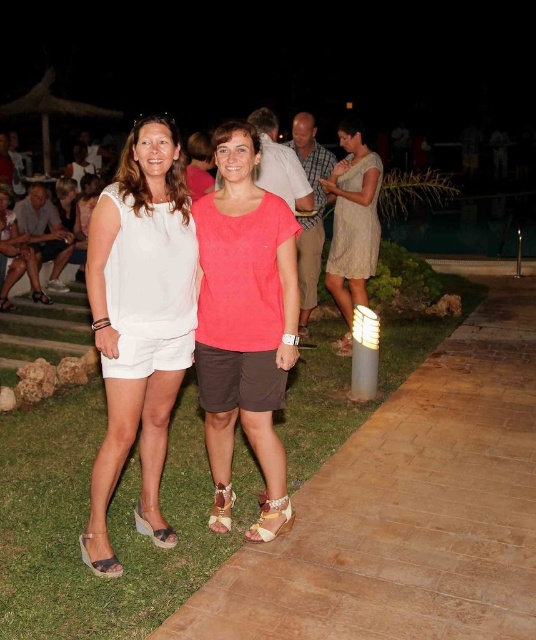
Is the position of white cotton shorts at center less distant than that of matte black wedge sandal at lower left?

That is True.

Is point (110, 429) less distant than point (139, 508)?

Yes, point (110, 429) is closer to viewer.

At what (x,y) coordinates should I click in order to perform the action: click on white cotton shorts at center. Please return your answer as a coordinate pair (x, y). This screenshot has width=536, height=640. Looking at the image, I should click on (139, 310).

Who is shorter, coral matte t-shirt at center or white fabric sandal at lower left?

Standing shorter between the two is white fabric sandal at lower left.

Who is more distant from viewer, (255, 148) or (40, 291)?

The point (40, 291) is more distant.

Between point (278, 244) and point (50, 304), which one is positioned behind?

Positioned behind is point (50, 304).

You are a GUI agent. You are given a task and a screenshot of the screen. Output one action in this format:
    pyautogui.click(x=<x>, y=<y>)
    Task: Click on the coral matte t-shirt at center
    
    Given the screenshot: What is the action you would take?
    pyautogui.click(x=245, y=317)

In the scene shown: Is leather sandal at center shorter than white fabric sandal at lower left?

Incorrect, leather sandal at center's height does not fall short of white fabric sandal at lower left's.

Who is higher up, leather sandal at center or white fabric sandal at lower left?

white fabric sandal at lower left is higher up.

Which is behind, point (219, 483) or point (33, 300)?

Positioned behind is point (33, 300).

Where is `leather sandal at center`? Image resolution: width=536 pixels, height=640 pixels. leather sandal at center is located at coordinates (221, 508).